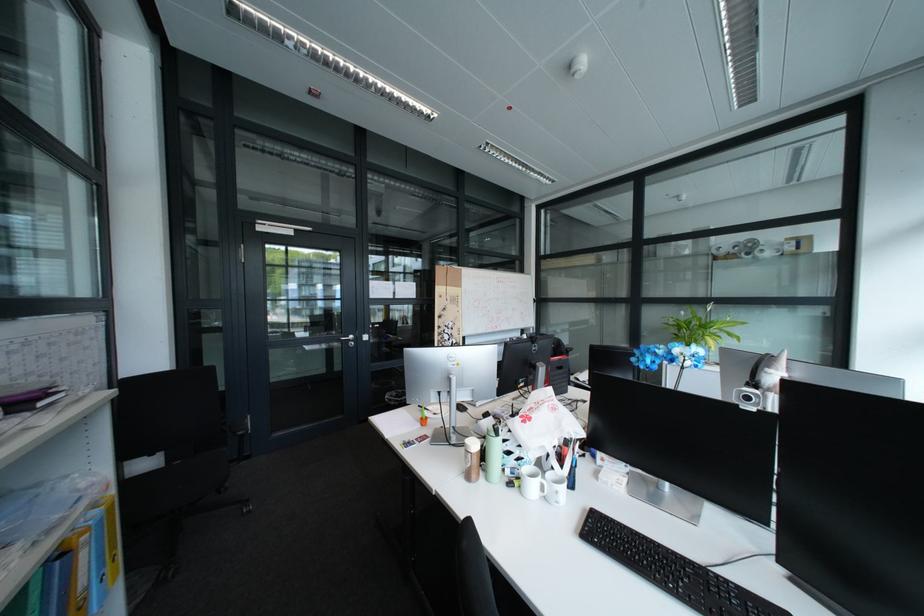
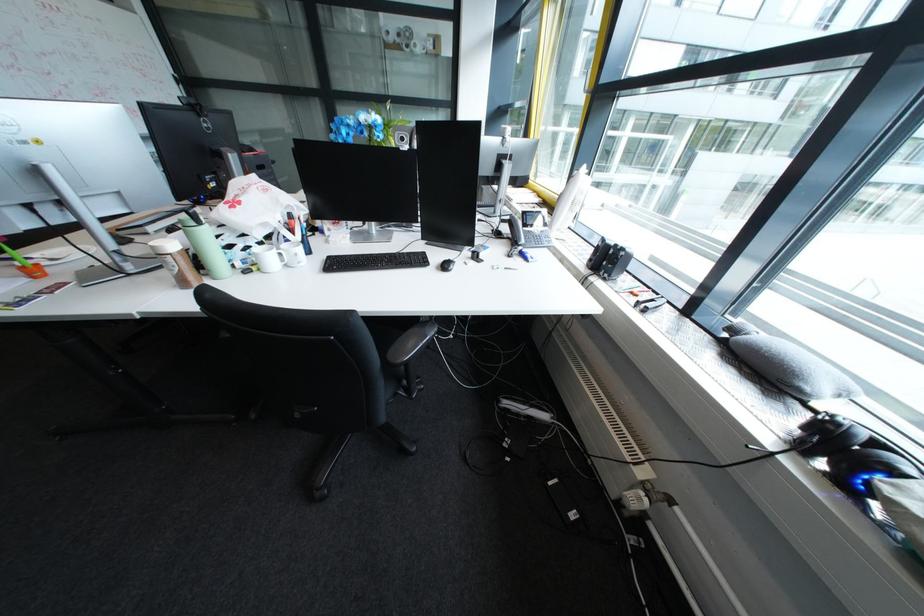
Where in the second image is the point corresponding to point 481,464 from the first image?

(187, 270)